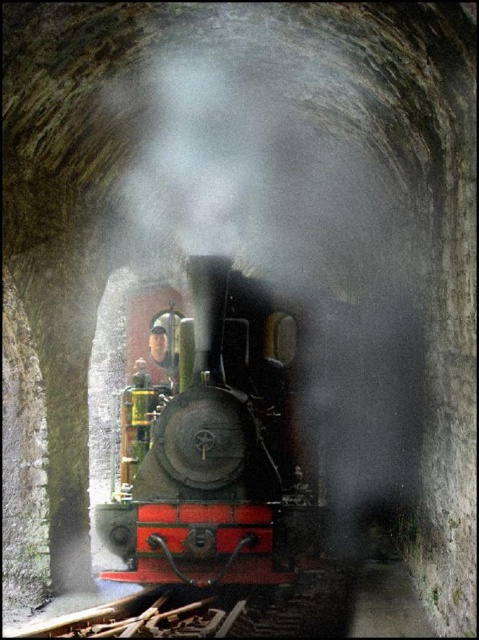
Question: Is polished brass steam engine at center to the left of green fabric conductor at center from the viewer's perspective?

Choices:
 (A) yes
 (B) no

Answer: (B)

Question: Is polished brass steam engine at center positioned in front of green fabric conductor at center?

Choices:
 (A) no
 (B) yes

Answer: (B)

Question: Is polished brass steam engine at center further to camera compared to green fabric conductor at center?

Choices:
 (A) yes
 (B) no

Answer: (B)

Question: Which object is closer to the camera taking this photo?

Choices:
 (A) polished brass steam engine at center
 (B) green fabric conductor at center

Answer: (A)